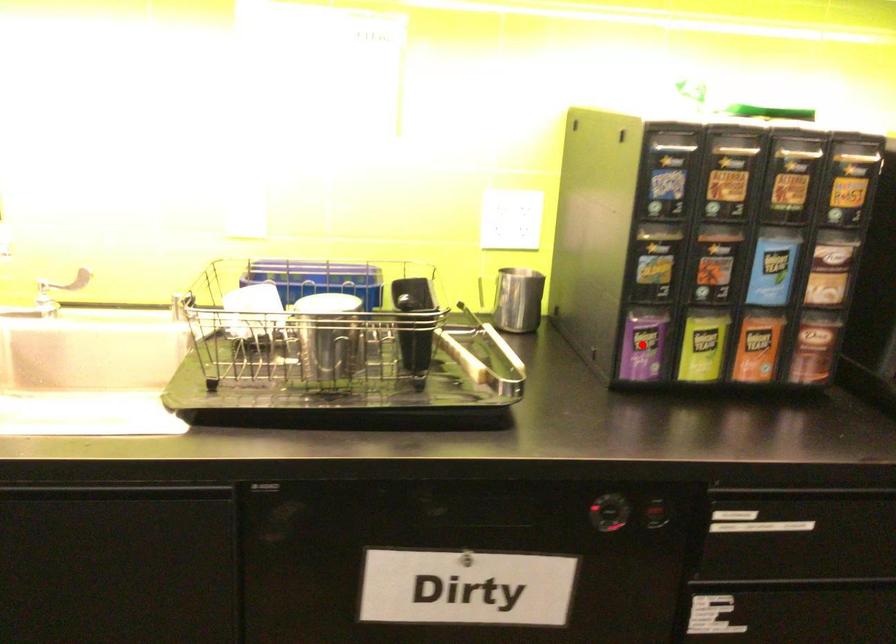
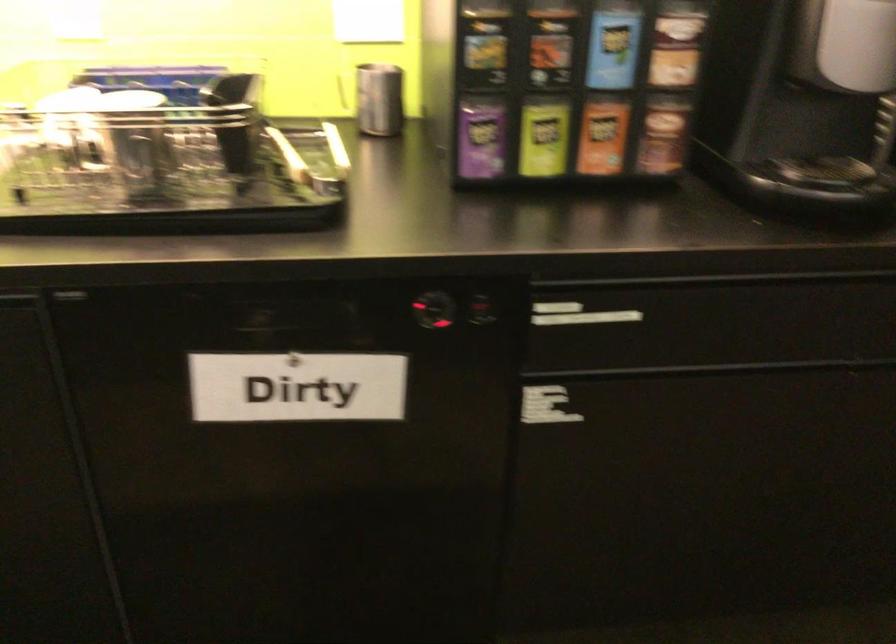
Locate, in the second image, the point that corresponds to the highlighted location in the first image.

(479, 138)